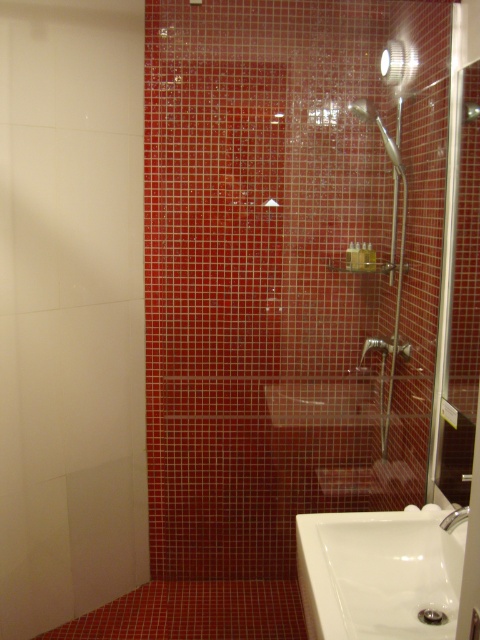
Question: Which of these objects is positioned farthest from the matte silver faucet at lower right?

Choices:
 (A) metallic silver shower head at upper center
 (B) transparent glass shower door at center
 (C) white glossy sink at lower right

Answer: (A)

Question: Is transparent glass shower door at center closer to camera compared to metallic silver shower head at upper center?

Choices:
 (A) yes
 (B) no

Answer: (A)

Question: Which point is closer to the camera taking this photo?

Choices:
 (A) (367, 115)
 (B) (465, 515)

Answer: (B)

Question: Among these points, which one is farthest from the camera?

Choices:
 (A) (369, 115)
 (B) (359, 561)

Answer: (A)

Question: Can you confirm if transparent glass shower door at center is positioned to the left of white glossy sink at lower right?

Choices:
 (A) yes
 (B) no

Answer: (A)

Question: Can you confirm if metallic silver shower head at upper center is positioned below matte silver faucet at lower right?

Choices:
 (A) yes
 (B) no

Answer: (B)